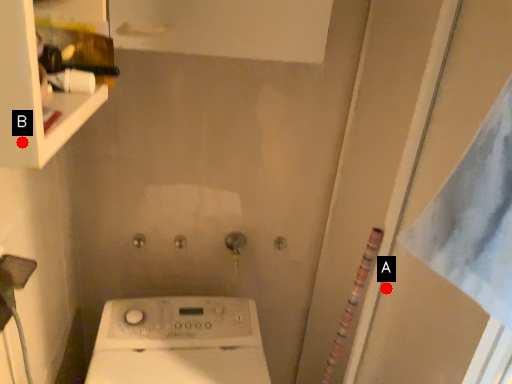
Question: Two points are circled on the image, labeled by A and B beside each circle. Which point is further to the camera?

Choices:
 (A) A is further
 (B) B is further

Answer: (A)